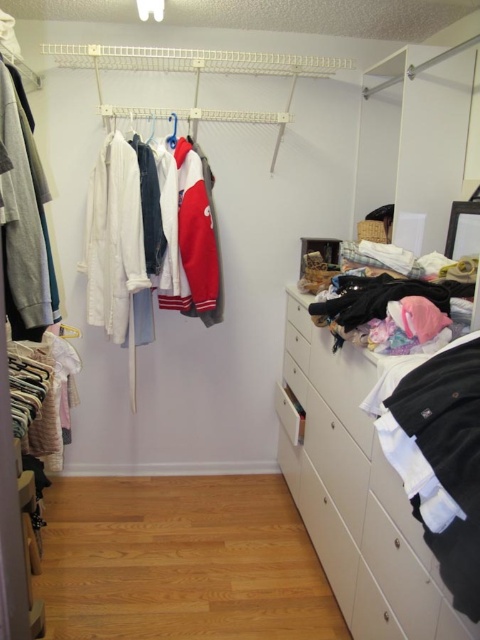
Question: Which object is closer to the camera taking this photo?

Choices:
 (A) white matte drawer at center
 (B) white glossy dresser at lower right
 (C) white cotton jackets at center

Answer: (B)

Question: Which point is closer to the camera?

Choices:
 (A) (196, 189)
 (B) (169, 118)
 (C) (367, 394)
 (D) (308, 355)

Answer: (C)

Question: Which point appears farthest from the camera in this image?

Choices:
 (A) (435, 566)
 (B) (171, 115)
 (C) (300, 310)
 (D) (192, 230)

Answer: (B)

Question: Is matte gray sweater at left to the left of white matte drawer at center from the viewer's perspective?

Choices:
 (A) yes
 (B) no

Answer: (A)

Question: Is white cotton jackets at center wider than white plastic drawer at center?

Choices:
 (A) yes
 (B) no

Answer: (A)

Question: Is white plastic drawer at center wider than white fabric hanger at upper left?

Choices:
 (A) no
 (B) yes

Answer: (B)